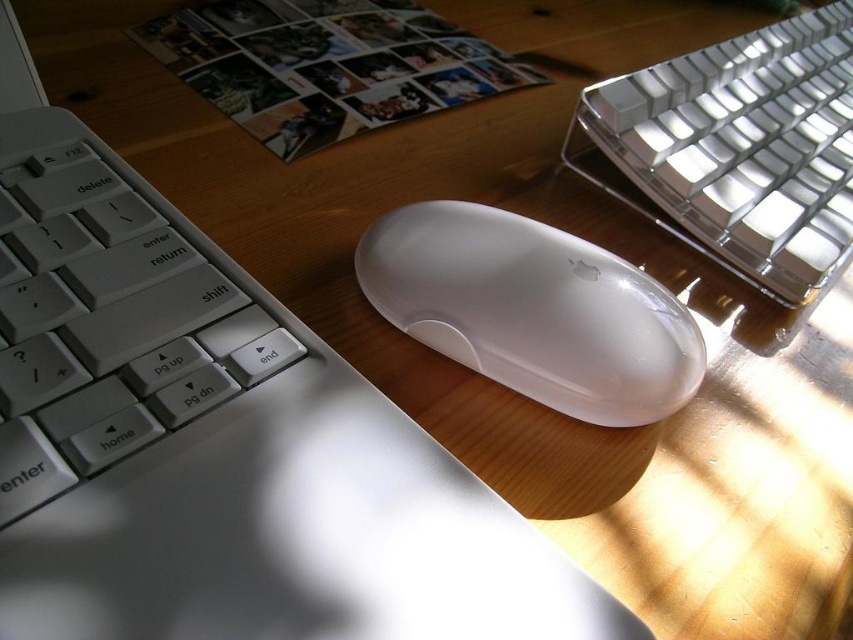
You need to place a new wireless charger that is 15 cm in diameter on your desk. Given the current arrangement with the satin silver keyboard at upper right and the satin white mouse at center, where would be the best spot to place it without overlapping either object?

The best spot would be near the lower left corner of the desk since the satin silver keyboard at upper right is larger and occupies more space, leaving the lower left area relatively open.

You are setting up a new workspace and want to ensure that your satin silver keyboard at upper right and satin white mouse at center are positioned correctly. Given their sizes, which object should you place closer to the edge of the desk to save space?

The satin white mouse at center is shorter in height than the satin silver keyboard at upper right. To save space, place the satin white mouse at center closer to the edge since it takes up less vertical space.